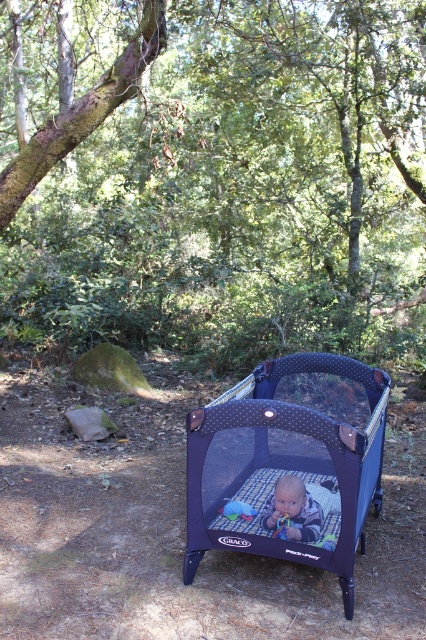
Consider the image. Is green mossy tree trunk at upper left closer to the viewer compared to dark blue fabric playpen at center?

No, it is behind dark blue fabric playpen at center.

Measure the distance between point (264, 291) and camera.

Point (264, 291) and camera are 27.34 feet apart.

Locate an element on the screen. The width and height of the screenshot is (426, 640). green mossy tree trunk at upper left is located at coordinates (215, 176).

Is point (173, 285) positioned after point (278, 518)?

Yes, point (173, 285) is farther from viewer.

Can you confirm if green mossy tree trunk at upper left is positioned to the left of blue fabric baby at center?

Correct, you'll find green mossy tree trunk at upper left to the left of blue fabric baby at center.

Does point (23, 22) come farther from viewer compared to point (311, 540)?

Yes, point (23, 22) is behind point (311, 540).

Identify the location of green mossy tree trunk at upper left. click(215, 176).

This screenshot has width=426, height=640. What are the coordinates of `dark blue fabric playpen at center` in the screenshot? It's located at (288, 461).

Can you confirm if dark blue fabric playpen at center is positioned above blue fabric baby at center?

Indeed, dark blue fabric playpen at center is positioned over blue fabric baby at center.

Find the location of a particular element. The height and width of the screenshot is (640, 426). dark blue fabric playpen at center is located at coordinates (288, 461).

The width and height of the screenshot is (426, 640). What are the coordinates of `dark blue fabric playpen at center` in the screenshot? It's located at (288, 461).